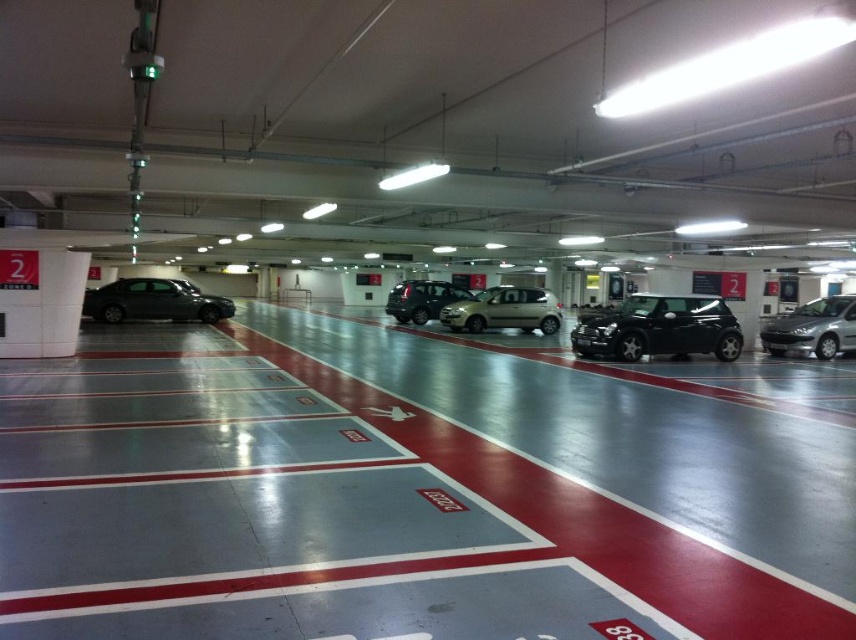
Is point (587, 317) positioned behind point (538, 312)?

No, it is not.

Does glossy black car at center have a larger size compared to satin silver hatchback at center?

Yes, glossy black car at center is bigger than satin silver hatchback at center.

Is point (572, 348) positioned in front of point (525, 296)?

Yes, it is in front of point (525, 296).

Locate an element on the screen. glossy black car at center is located at coordinates (658, 328).

Who is shorter, gray concrete floor at center or shiny black sedan at left?

With less height is gray concrete floor at center.

Who is higher up, gray concrete floor at center or shiny black sedan at left?

shiny black sedan at left is above.

Is point (705, 621) less distant than point (116, 285)?

Yes, it is.

Identify the location of gray concrete floor at center. (418, 488).

Can you confirm if gray concrete floor at center is bigger than satin black suv at center?

No, gray concrete floor at center is not bigger than satin black suv at center.

Looking at this image, is gray concrete floor at center positioned in front of satin black suv at center?

Yes, gray concrete floor at center is closer to the viewer.

You are a GUI agent. You are given a task and a screenshot of the screen. Output one action in this format:
    pyautogui.click(x=<x>, y=<y>)
    Task: Click on the gray concrete floor at center
    
    Given the screenshot: What is the action you would take?
    pyautogui.click(x=418, y=488)